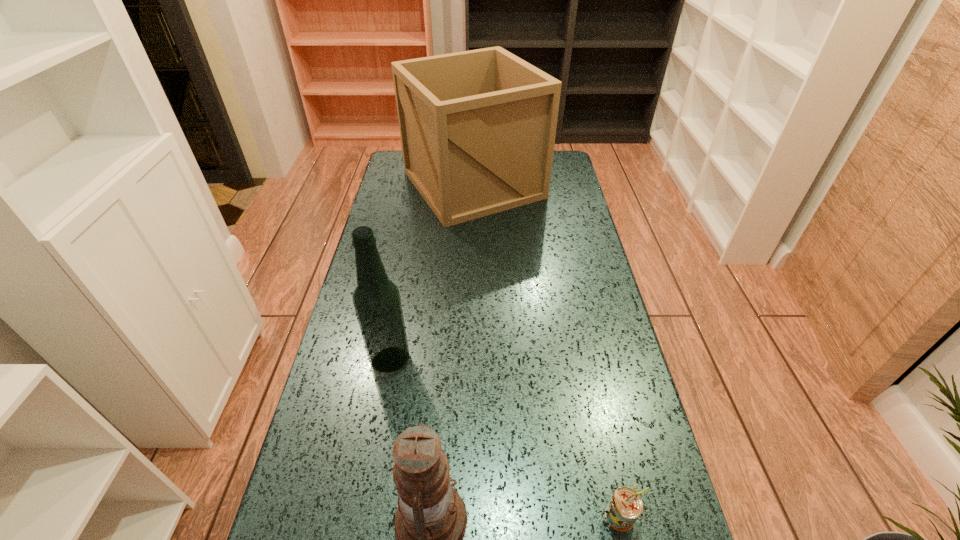
Image resolution: width=960 pixels, height=540 pixels. I want to click on free space between the can and the box, so click(547, 349).

Identify the location of free space between the farthest object and the shortest object. This screenshot has height=540, width=960. point(547,349).

This screenshot has width=960, height=540. Identify the location of object that is the third nearest to the can. (477, 128).

Find the location of a particular element. the third closest object to the oil lamp is located at coordinates (477, 128).

I want to click on vacant space that satisfies the following two spatial constraints: 1. on the front side of the farthest object; 2. on the right side of the shortest object, so click(x=468, y=513).